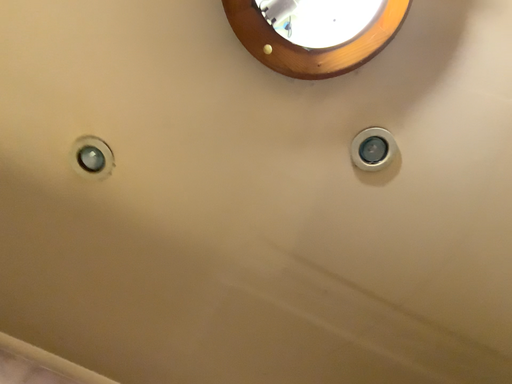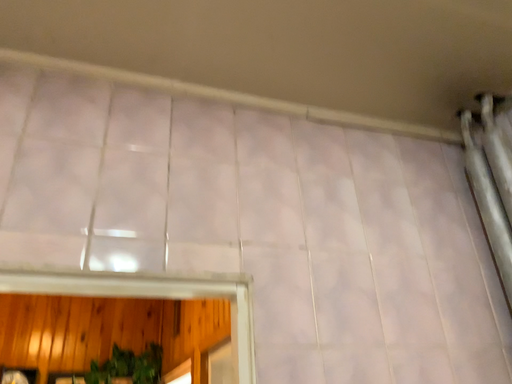
Question: Which way did the camera rotate in the video?

Choices:
 (A) rotated downward
 (B) rotated upward

Answer: (A)